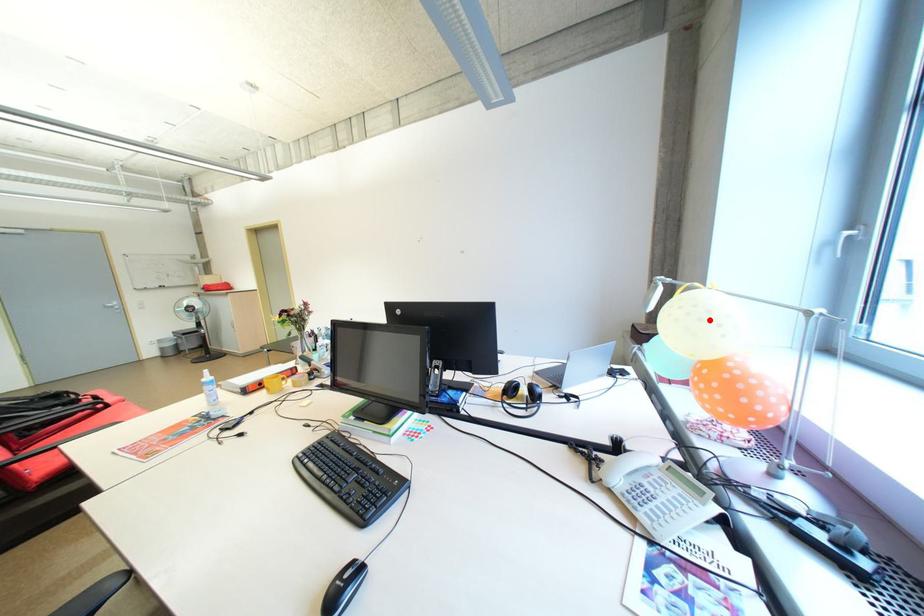
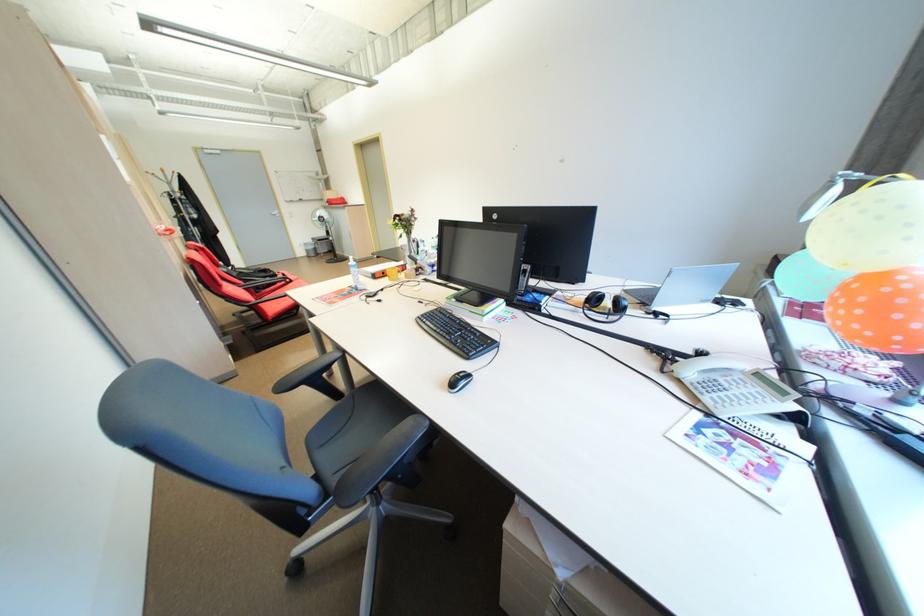
Locate, in the second image, the point that corresponds to the highlighted location in the first image.

(889, 219)